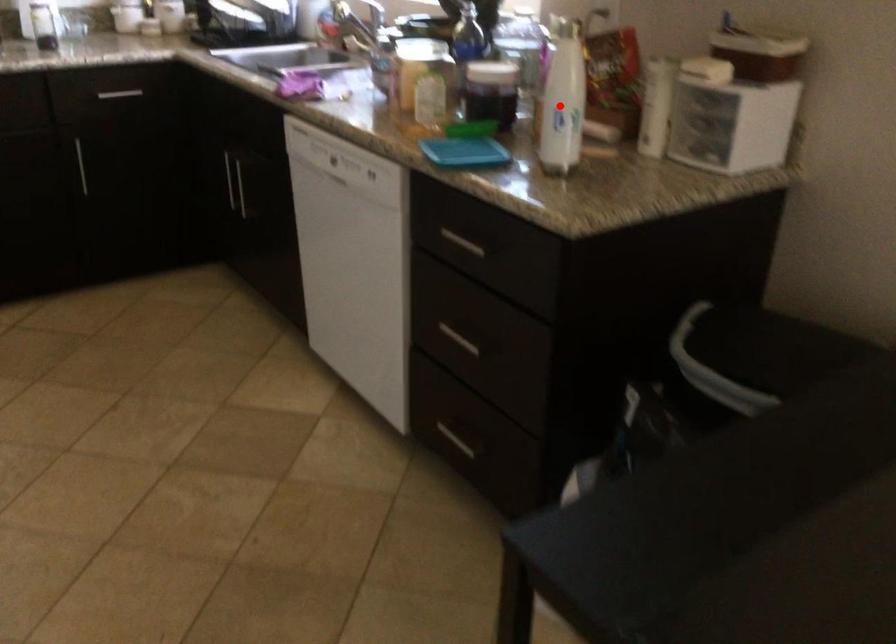
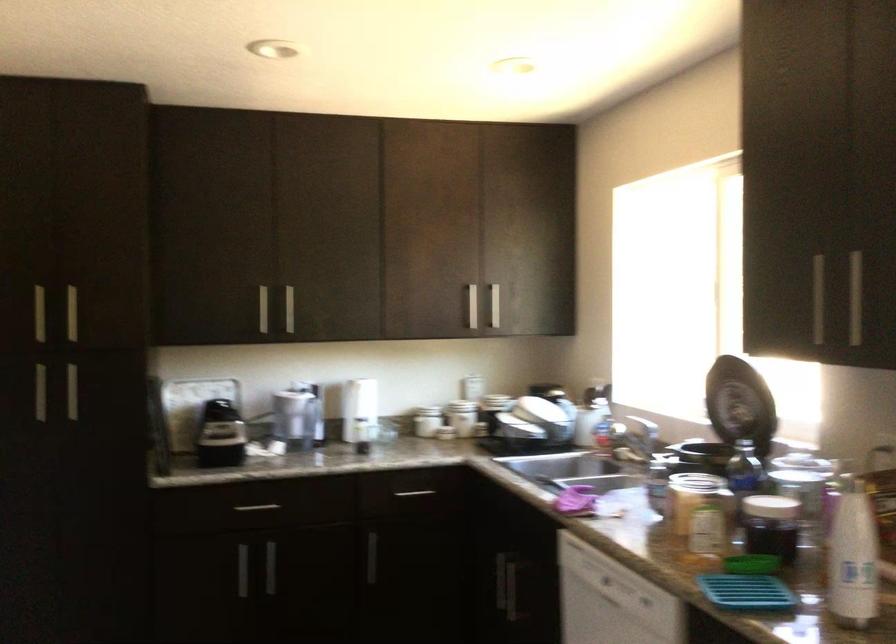
Question: I am providing you with two images of the same scene from different viewpoints. A red point is marked on the first image. Can you still see the location of the red point in image 2?

Choices:
 (A) Yes
 (B) No

Answer: (A)